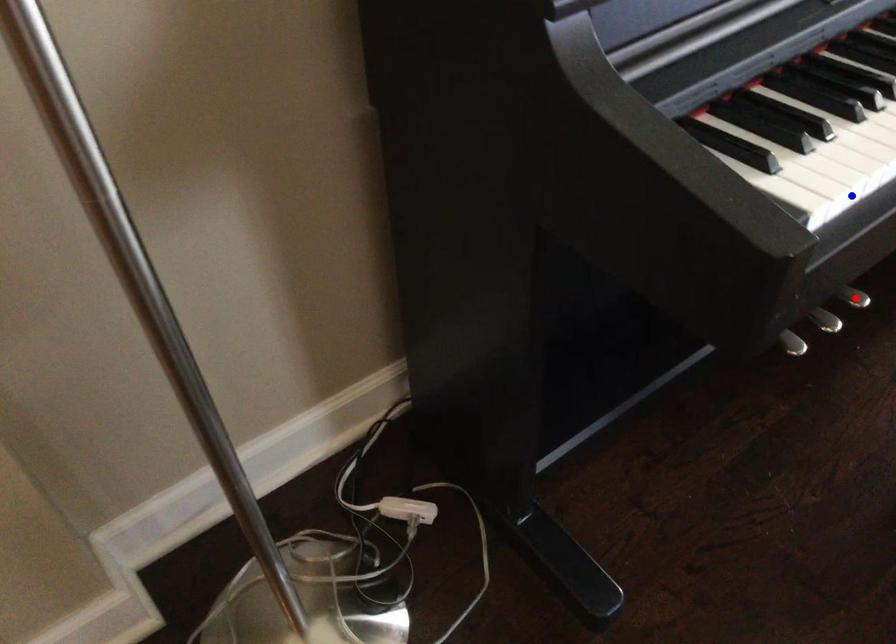
Question: In the image, two points are highlighted. Which point is nearer to the camera? Reply with the corresponding letter.

Choices:
 (A) blue point
 (B) red point

Answer: (A)